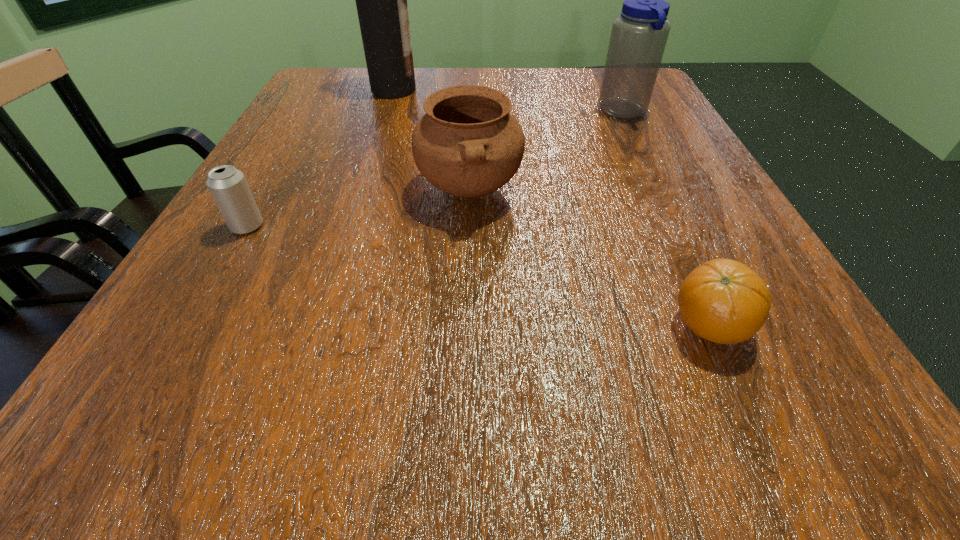
Where is `vacant space that's between the fourth object from right to left and the leftmost object`? The image size is (960, 540). vacant space that's between the fourth object from right to left and the leftmost object is located at coordinates (321, 158).

Locate an element on the screen. empty location between the third object from right to left and the leftmost object is located at coordinates pos(358,208).

Where is `vacant area that lies between the water bottle and the nearest object`? The width and height of the screenshot is (960, 540). vacant area that lies between the water bottle and the nearest object is located at coordinates (666, 219).

Where is `object that is the nearest to the pottery`? This screenshot has height=540, width=960. object that is the nearest to the pottery is located at coordinates (724, 301).

Locate which object is the fourth closest to the third shortest object. Please provide its 2D coordinates. Your answer should be formatted as a tuple, i.e. [(x, y)], where the tuple contains the x and y coordinates of a point satisfying the conditions above.

[(381, 0)]

The image size is (960, 540). In order to click on vacant area in the image that satisfies the following two spatial constraints: 1. on the label of the second object from left to right; 2. on the right side of the third tallest object in this screenshot , I will do `click(362, 190)`.

Locate an element on the screen. Image resolution: width=960 pixels, height=540 pixels. free space that satisfies the following two spatial constraints: 1. on the label of the wine bottle; 2. on the right side of the third shortest object is located at coordinates (362, 190).

Where is `vacant space that satisfies the following two spatial constraints: 1. with a carrying loop on the side of the water bottle; 2. on the front side of the third object from left to right`? vacant space that satisfies the following two spatial constraints: 1. with a carrying loop on the side of the water bottle; 2. on the front side of the third object from left to right is located at coordinates (661, 190).

Identify the location of free region that satisfies the following two spatial constraints: 1. on the label of the wine bottle; 2. on the left side of the pottery. (362, 190).

Locate an element on the screen. Image resolution: width=960 pixels, height=540 pixels. free location that satisfies the following two spatial constraints: 1. on the back side of the third object from right to left; 2. on the label of the wine bottle is located at coordinates click(472, 90).